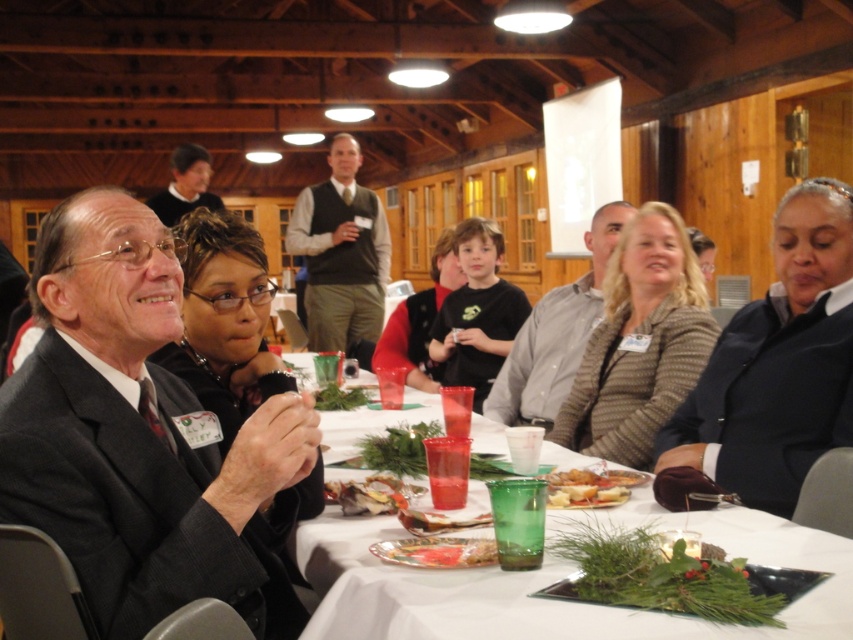
How distant is dark green sweater at center from green leafy garnish at center?

2.24 meters

Does dark green sweater at center have a lesser width compared to green leafy garnish at center?

Incorrect, dark green sweater at center's width is not less than green leafy garnish at center's.

At what (x,y) coordinates should I click in order to perform the action: click on dark green sweater at center. Please return your answer as a coordinate pair (x, y). Image resolution: width=853 pixels, height=640 pixels. Looking at the image, I should click on (341, 252).

Identify the location of dark green sweater at center. (341, 252).

Who is shorter, dark green sweater at center or matte plastic sandwich at center?

Standing shorter between the two is matte plastic sandwich at center.

Can you confirm if dark green sweater at center is smaller than matte plastic sandwich at center?

No.

Who is more distant from viewer, (x=349, y=240) or (x=448, y=545)?

Positioned behind is point (x=349, y=240).

Find the location of a particular element. This screenshot has height=640, width=853. dark green sweater at center is located at coordinates (341, 252).

Does dark green sweater at center have a larger size compared to gray shirt at center?

Yes.

At what (x,y) coordinates should I click in order to perform the action: click on dark green sweater at center. Please return your answer as a coordinate pair (x, y). The width and height of the screenshot is (853, 640). Looking at the image, I should click on (341, 252).